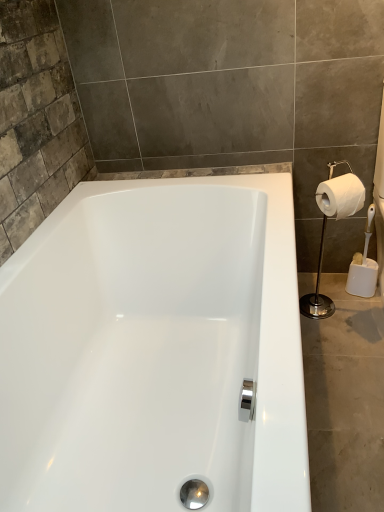
Locate an element on the screen. This screenshot has height=512, width=384. white matte toilet paper at right is located at coordinates (340, 196).

This screenshot has height=512, width=384. Describe the element at coordinates (340, 196) in the screenshot. I see `white matte toilet paper at right` at that location.

What is the approximate width of white glossy toilet paper holder at right?

white glossy toilet paper holder at right is 15.82 centimeters in width.

What do you see at coordinates (325, 228) in the screenshot? I see `white glossy toilet paper holder at right` at bounding box center [325, 228].

You are a GUI agent. You are given a task and a screenshot of the screen. Output one action in this format:
    pyautogui.click(x=<x>, y=<y>)
    Task: Click on the white glossy toilet paper holder at right
    The width and height of the screenshot is (384, 512).
    Given the screenshot: What is the action you would take?
    pyautogui.click(x=325, y=228)

At what (x,y) coordinates should I click in order to perform the action: click on white matte toilet paper at right. Please return your answer as a coordinate pair (x, y). Looking at the image, I should click on (340, 196).

Between white matte toilet paper at right and white glossy toilet paper holder at right, which one appears on the right side from the viewer's perspective?

From the viewer's perspective, white matte toilet paper at right appears more on the right side.

Does white matte toilet paper at right lie in front of white glossy toilet paper holder at right?

Yes, it is in front of white glossy toilet paper holder at right.

Considering the positions of point (348, 183) and point (319, 259), is point (348, 183) closer or farther from the camera than point (319, 259)?

Point (348, 183) is closer to the camera than point (319, 259).

From the image's perspective, is white matte toilet paper at right positioned above or below white glossy toilet paper holder at right?

Clearly, from the image's perspective, white matte toilet paper at right is above white glossy toilet paper holder at right.

From a real-world perspective, which is physically above, white matte toilet paper at right or white glossy toilet paper holder at right?

white matte toilet paper at right.

Which of these two, white matte toilet paper at right or white glossy toilet paper holder at right, is thinner?

white matte toilet paper at right is thinner.

Considering the relative sizes of white matte toilet paper at right and white glossy toilet paper holder at right in the image provided, is white matte toilet paper at right taller than white glossy toilet paper holder at right?

In fact, white matte toilet paper at right may be shorter than white glossy toilet paper holder at right.

Does white matte toilet paper at right have a larger size compared to white glossy toilet paper holder at right?

No, white matte toilet paper at right is not bigger than white glossy toilet paper holder at right.

Can white glossy toilet paper holder at right be found inside white matte toilet paper at right?

Actually, white glossy toilet paper holder at right is outside white matte toilet paper at right.

Can you see white matte toilet paper at right touching white glossy toilet paper holder at right?

Yes, white matte toilet paper at right and white glossy toilet paper holder at right clearly make contact.

Is white matte toilet paper at right looking in the opposite direction of white glossy toilet paper holder at right?

Correct, white matte toilet paper at right is looking away from white glossy toilet paper holder at right.

How distant is white matte toilet paper at right from white glossy toilet paper holder at right?

white matte toilet paper at right is 0.59 inches from white glossy toilet paper holder at right.

Where is `toilet paper to the right of white glossy toilet paper holder at right`? The height and width of the screenshot is (512, 384). toilet paper to the right of white glossy toilet paper holder at right is located at coordinates (340, 196).

Can you confirm if white glossy toilet paper holder at right is positioned to the left of white matte toilet paper at right?

Indeed, white glossy toilet paper holder at right is positioned on the left side of white matte toilet paper at right.

From the picture: In the image, is white glossy toilet paper holder at right positioned in front of or behind white matte toilet paper at right?

white glossy toilet paper holder at right is behind white matte toilet paper at right.

Which point is more distant from viewer, [336,200] or [330,215]?

The point [330,215] is farther.

From the image's perspective, is white glossy toilet paper holder at right located above or below white matte toilet paper at right?

Based on their image positions, white glossy toilet paper holder at right is located beneath white matte toilet paper at right.

In the scene shown: From a real-world perspective, is white glossy toilet paper holder at right on top of white matte toilet paper at right?

No.

Considering the sizes of white glossy toilet paper holder at right and white matte toilet paper at right in the image, is white glossy toilet paper holder at right wider or thinner than white matte toilet paper at right?

white glossy toilet paper holder at right is wider than white matte toilet paper at right.

Which of these two, white glossy toilet paper holder at right or white matte toilet paper at right, stands taller?

With more height is white glossy toilet paper holder at right.

Considering the sizes of objects white glossy toilet paper holder at right and white matte toilet paper at right in the image provided, who is bigger, white glossy toilet paper holder at right or white matte toilet paper at right?

white glossy toilet paper holder at right.

Is white glossy toilet paper holder at right outside of white matte toilet paper at right?

Yes, white glossy toilet paper holder at right is outside of white matte toilet paper at right.

Is white glossy toilet paper holder at right not near white matte toilet paper at right?

Actually, white glossy toilet paper holder at right and white matte toilet paper at right are a little close together.

Is white glossy toilet paper holder at right facing towards white matte toilet paper at right?

Yes, white glossy toilet paper holder at right is oriented towards white matte toilet paper at right.

How different are the orientations of white glossy toilet paper holder at right and white matte toilet paper at right in degrees?

12.4 degrees.

How distant is white glossy toilet paper holder at right from white matte toilet paper at right?

white glossy toilet paper holder at right and white matte toilet paper at right are 0.59 inches apart from each other.

Locate an element on the screen. The width and height of the screenshot is (384, 512). toilet paper above the white glossy toilet paper holder at right (from a real-world perspective) is located at coordinates (340, 196).

This screenshot has width=384, height=512. I want to click on shower behind the white matte toilet paper at right, so click(325, 228).

Identify the location of shower located underneath the white matte toilet paper at right (from a real-world perspective). (325, 228).